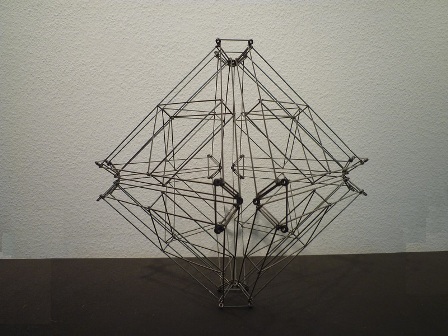
At what (x,y) coordinates should I click in order to perform the action: click on wall. Please return your answer as a coordinate pair (x, y). The image size is (448, 336). Looking at the image, I should click on (416, 85), (92, 87).